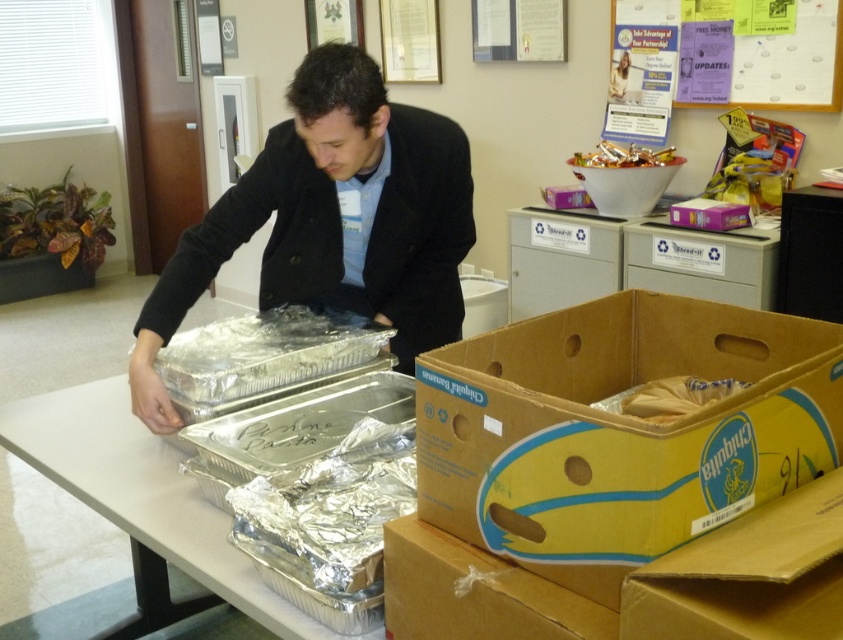
You are a delivery person who needs to place a new package in the office. The package is 10 cm thick. You see the cardboard box at lower right and the matte black jacket at center. Which object can the package fit behind without overlapping?

The cardboard box at lower right is thinner than the matte black jacket at center. Since the package is 10 cm thick, it can fit behind the matte black jacket at center as it is thicker than the package.

You are standing in the office scene where a man is preparing food. You see two points marked in the image. The first point is at coordinates point (626, 568) and the second point is at point (619, 160). Which point is closer to you?

Point (626, 568) is in front of point (619, 160), so the first point is closer to you.

You are a delivery person who just arrived at the office. You see the cardboard box at lower right and the matte black jacket at center. Which object is shorter in height?

The cardboard box at lower right is not as tall as the matte black jacket at center, so the cardboard box at lower right is shorter.